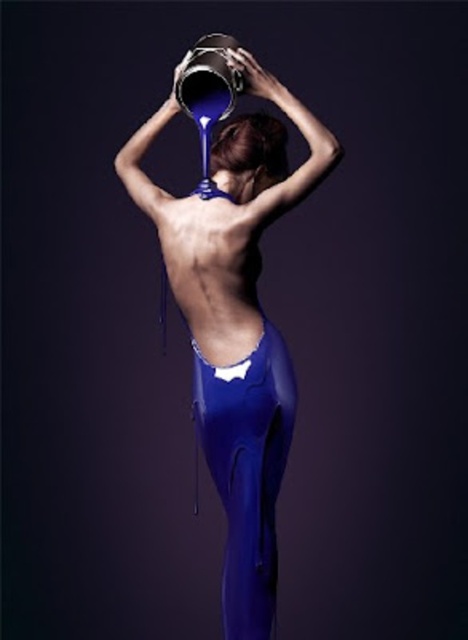
Is glossy blue liquid at upper center positioned at the back of white matte bikini top at center?

That is False.

Between glossy blue liquid at upper center and white matte bikini top at center, which one has less height?

white matte bikini top at center

Is point (277, 163) positioned in front of point (212, 195)?

No, (277, 163) is further to viewer.

I want to click on glossy blue liquid at upper center, so click(235, 320).

Which is more to the right, glossy blue liquid at upper center or shiny blue tight at lower center?

shiny blue tight at lower center is more to the right.

Is the position of glossy blue liquid at upper center less distant than that of shiny blue tight at lower center?

No, glossy blue liquid at upper center is behind shiny blue tight at lower center.

Where is `glossy blue liquid at upper center`? The width and height of the screenshot is (468, 640). glossy blue liquid at upper center is located at coordinates tap(235, 320).

Is satin brown hair at upper center shorter than white matte bikini top at center?

In fact, satin brown hair at upper center may be taller than white matte bikini top at center.

Can you confirm if satin brown hair at upper center is wider than white matte bikini top at center?

Yes, satin brown hair at upper center is wider than white matte bikini top at center.

Describe the element at coordinates (248, 156) in the screenshot. The image size is (468, 640). I see `satin brown hair at upper center` at that location.

Where is `satin brown hair at upper center`? satin brown hair at upper center is located at coordinates (248, 156).